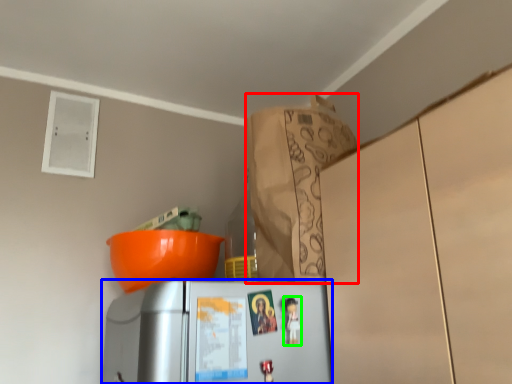
Question: Based on their relative distances, which object is farther from paper bag (highlighted by a red box)? Choose from refrigerator (highlighted by a blue box) and toy (highlighted by a green box).

Choices:
 (A) refrigerator
 (B) toy

Answer: (B)